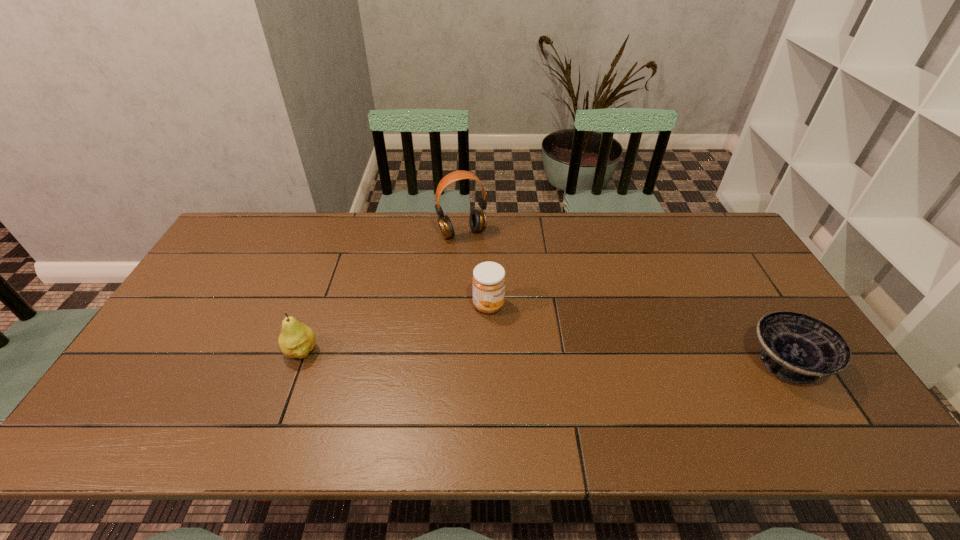
I want to click on vacant area at the left edge of the desktop, so click(x=195, y=364).

Where is `free space at the right edge of the desktop`? This screenshot has width=960, height=540. free space at the right edge of the desktop is located at coordinates pos(721,293).

Identify the location of blank space at the far right corner of the desktop. (711, 248).

Locate an element on the screen. The height and width of the screenshot is (540, 960). free space between the shortest object and the leftmost object is located at coordinates (543, 357).

Find the location of a particular element. free point between the bowl and the farthest object is located at coordinates (624, 298).

Locate an element on the screen. free space between the bowl and the third nearest object is located at coordinates (637, 334).

Locate an element on the screen. Image resolution: width=960 pixels, height=540 pixels. vacant space that is in between the shortest object and the pear is located at coordinates coord(543,357).

Find the location of a particular element. This screenshot has height=540, width=960. vacant area that lies between the pear and the rightmost object is located at coordinates (543, 357).

Find the location of `free space between the leftmost object and the shortest object`. free space between the leftmost object and the shortest object is located at coordinates (543, 357).

Identify the location of vacant area that lies between the headset and the pear. The height and width of the screenshot is (540, 960). (382, 292).